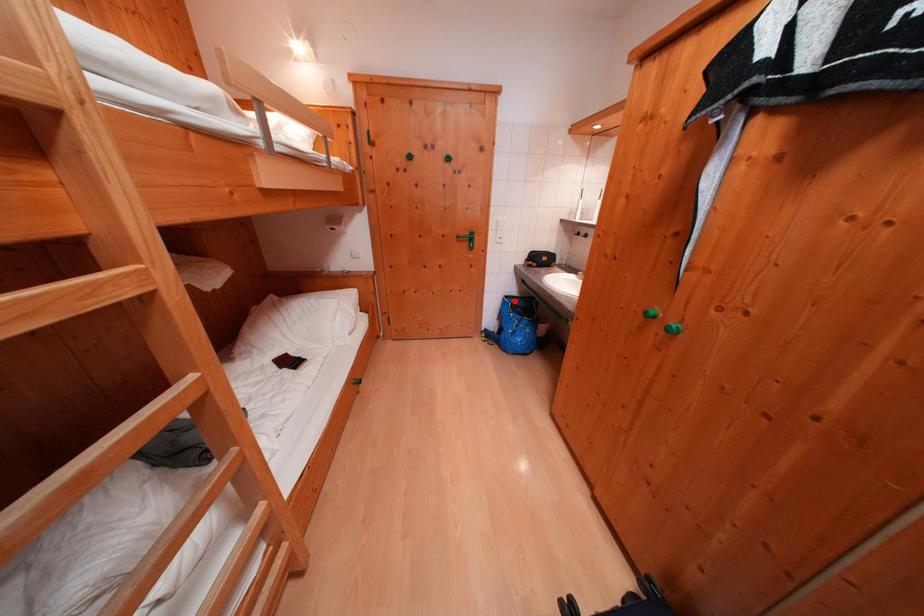
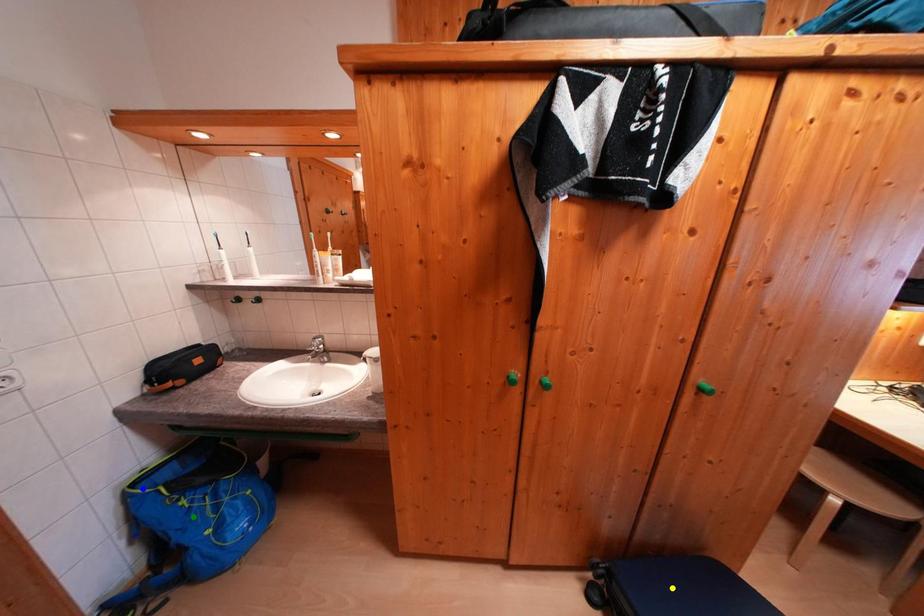
Question: I am providing you with two images of the same scene from different viewpoints. A red point is marked on the first image. You are given multiple points on the second image. Which mark in image 2 goes with the point in image 1?

Choices:
 (A) green point
 (B) blue point
 (C) yellow point

Answer: (B)